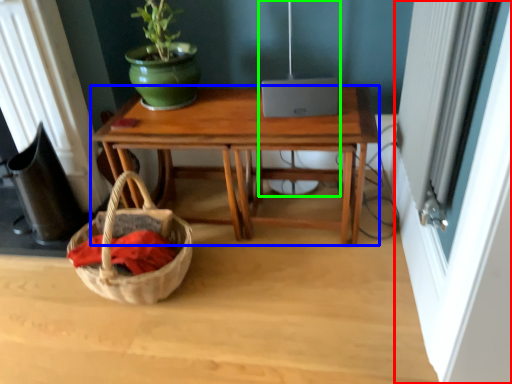
Question: Which is nearer to the screen door (highlighted by a red box)? desk (highlighted by a blue box) or lamp (highlighted by a green box).

Choices:
 (A) desk
 (B) lamp

Answer: (A)